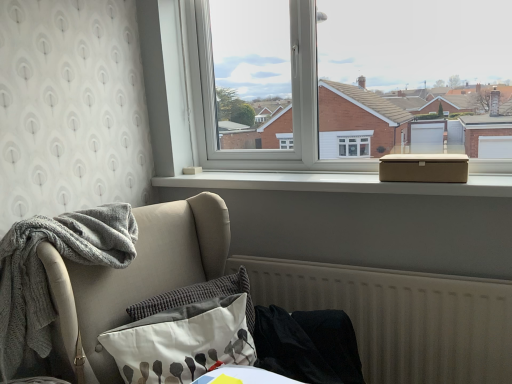
The width and height of the screenshot is (512, 384). Find the location of `vacant space situated on the left part of brown cardboard box at upper right`. vacant space situated on the left part of brown cardboard box at upper right is located at coordinates (367, 182).